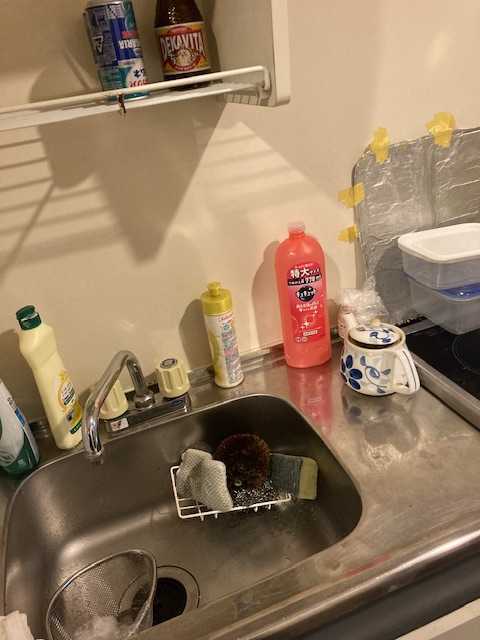
Locate an element on the screen. sink is located at coordinates (252, 564).